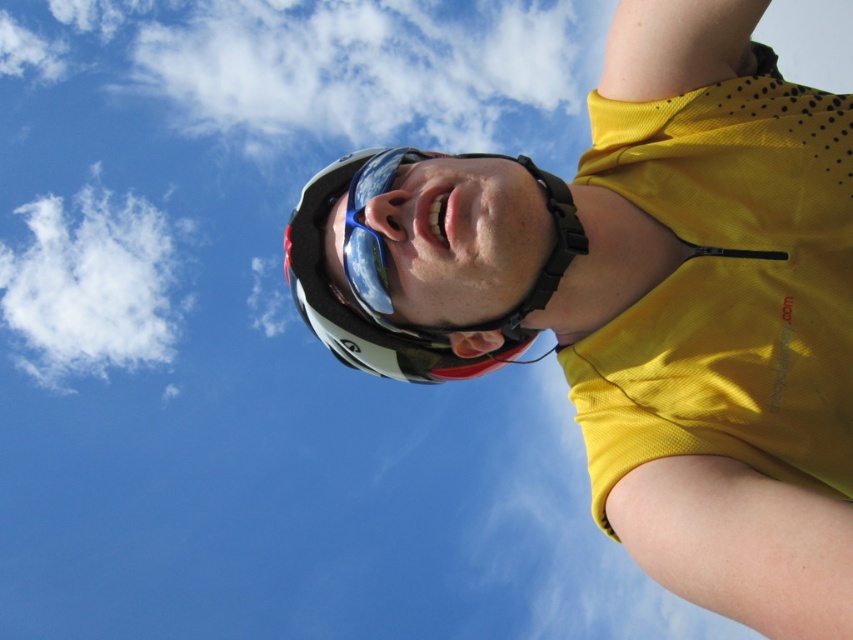
Question: Which object appears farthest from the camera in this image?

Choices:
 (A) white fluffy cloud at upper left
 (B) white matte bicycle helmet at center

Answer: (A)

Question: Which object is closer to the camera taking this photo?

Choices:
 (A) white matte helmet at upper center
 (B) white matte bicycle helmet at center

Answer: (A)

Question: Which object is the closest to the white matte bicycle helmet at center?

Choices:
 (A) white fluffy cloud at upper left
 (B) white matte helmet at upper center

Answer: (B)

Question: Does white fluffy cloud at upper left lie behind blue reflective goggles at center?

Choices:
 (A) no
 (B) yes

Answer: (B)

Question: Observing the image, what is the correct spatial positioning of white matte helmet at upper center in reference to white matte bicycle helmet at center?

Choices:
 (A) above
 (B) below

Answer: (A)

Question: Is white matte helmet at upper center smaller than white matte bicycle helmet at center?

Choices:
 (A) no
 (B) yes

Answer: (A)